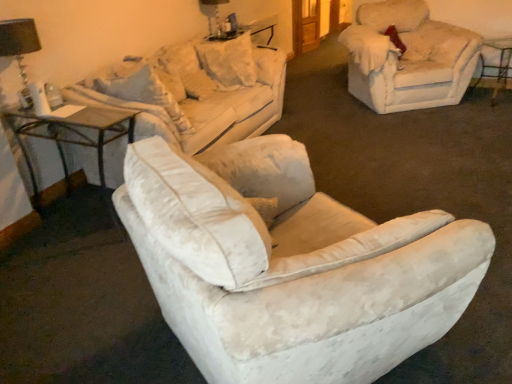
Question: Which is correct: black fabric lampshade at upper left, the 1th table lamp from the bottom, is inside fuzzy beige chair at upper right, or outside of it?

Choices:
 (A) outside
 (B) inside

Answer: (A)

Question: Is point (31, 23) closer or farther from the camera than point (356, 97)?

Choices:
 (A) closer
 (B) farther

Answer: (A)

Question: Estimate the real-world distances between objects in this image. Which object is closer to the velvet beige couch at upper left?

Choices:
 (A) matte black table lamp at upper center, positioned as the second table lamp in left-to-right order
 (B) metallic silver bar stool at right
 (C) fuzzy beige chair at upper right
 (D) white velvety pillow at upper center, the 2th pillow from the right
 (E) wooden glass table at left

Answer: (D)

Question: Which is farther from the matte black table lamp at upper center, the 1th table lamp viewed from the back?

Choices:
 (A) black fabric lampshade at upper left, the 2th table lamp in the top-to-bottom sequence
 (B) metallic silver bar stool at right
 (C) velvet beige couch at upper left
 (D) wooden glass table at left
 (E) white velvety pillow at upper center, placed as the first pillow when sorted from left to right

Answer: (B)